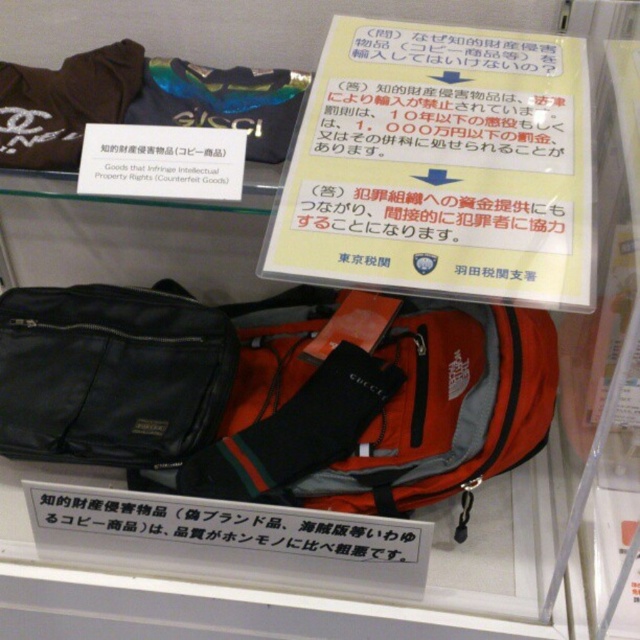
Can you confirm if yellow paper at upper center is bigger than matte black bag at left?

Yes.

Is yellow paper at upper center taller than matte black bag at left?

Indeed, yellow paper at upper center has a greater height compared to matte black bag at left.

Who is more forward, (337, 138) or (228, 381)?

Positioned in front is point (337, 138).

Locate an element on the screen. This screenshot has height=640, width=640. yellow paper at upper center is located at coordinates (440, 168).

Can you confirm if orange fabric backpack at center is positioned below white paper sign at center?

Incorrect, orange fabric backpack at center is not positioned below white paper sign at center.

This screenshot has width=640, height=640. What do you see at coordinates (422, 417) in the screenshot?
I see `orange fabric backpack at center` at bounding box center [422, 417].

Where is `orange fabric backpack at center`? orange fabric backpack at center is located at coordinates (422, 417).

Measure the distance between point (572, 90) and camera.

29.34 inches

The height and width of the screenshot is (640, 640). Describe the element at coordinates (440, 168) in the screenshot. I see `yellow paper at upper center` at that location.

Does point (580, 276) lie behind point (397, 589)?

No, (580, 276) is in front of (397, 589).

Where is `yellow paper at upper center`? yellow paper at upper center is located at coordinates (440, 168).